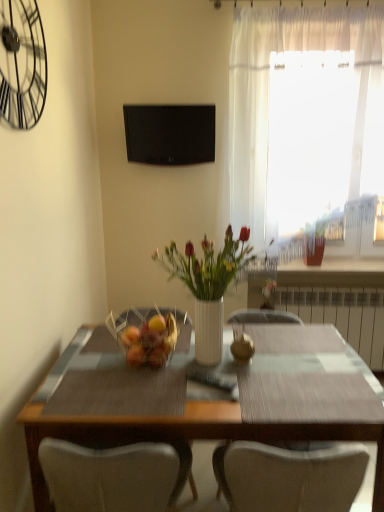
At what (x,y) coordinates should I click in order to perform the action: click on empty space that is ontop of wooden table at center (from a real-world perspective). Please return your answer as a coordinate pair (x, y). This screenshot has height=512, width=384. Looking at the image, I should click on (218, 380).